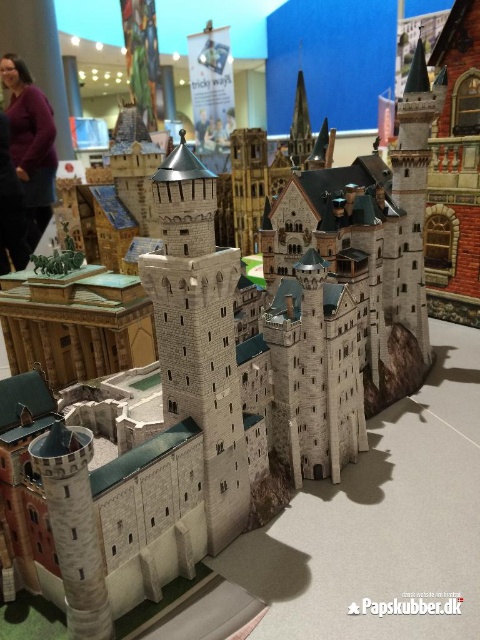
Is stone tower at center above purple matte sweater at upper left?

Incorrect, stone tower at center is not positioned above purple matte sweater at upper left.

Between stone tower at center and purple matte sweater at upper left, which one appears on the left side from the viewer's perspective?

Positioned to the left is purple matte sweater at upper left.

Does point (217, 499) come in front of point (31, 138)?

Yes, point (217, 499) is closer to viewer.

At what (x,y) coordinates should I click in order to perform the action: click on stone tower at center. Please return your answer as a coordinate pair (x, y). Image resolution: width=480 pixels, height=640 pixels. Looking at the image, I should click on (199, 333).